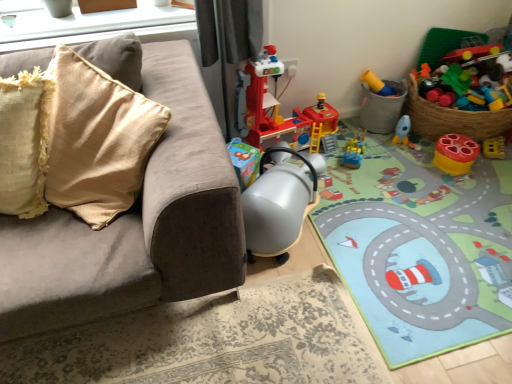
Question: Considering the relative positions of plastic yellow toy at upper right, which ranks as the fourth toy in right-to-left order, and matte plastic toy at right, the 5th toy in the left-to-right sequence, in the image provided, is plastic yellow toy at upper right, which ranks as the fourth toy in right-to-left order, to the right of matte plastic toy at right, the 5th toy in the left-to-right sequence, from the viewer's perspective?

Choices:
 (A) yes
 (B) no

Answer: (B)

Question: Does plastic yellow toy at upper right, which is the third toy in left-to-right order, have a smaller size compared to matte plastic toy at right, the 5th toy in the left-to-right sequence?

Choices:
 (A) no
 (B) yes

Answer: (A)

Question: Is plastic yellow toy at upper right, which ranks as the fourth toy in right-to-left order, shorter than matte plastic toy at right, the 5th toy in the left-to-right sequence?

Choices:
 (A) yes
 (B) no

Answer: (B)

Question: Is plastic yellow toy at upper right, which is the third toy in left-to-right order, with matte plastic toy at right, marked as the second toy in a right-to-left arrangement?

Choices:
 (A) no
 (B) yes

Answer: (A)

Question: Does plastic yellow toy at upper right, which is the third toy in left-to-right order, appear on the left side of matte plastic toy at right, the 5th toy in the left-to-right sequence?

Choices:
 (A) yes
 (B) no

Answer: (A)

Question: From the image's perspective, is matte plastic toy at right, marked as the second toy in a right-to-left arrangement, positioned above or below matte plastic rocket at lower right, which appears as the 3th toy when viewed from the right?

Choices:
 (A) below
 (B) above

Answer: (A)

Question: In the image, is matte plastic toy at right, the 5th toy in the left-to-right sequence, positioned in front of or behind matte plastic rocket at lower right, the fourth toy positioned from the left?

Choices:
 (A) front
 (B) behind

Answer: (A)

Question: In the image, is matte plastic toy at right, marked as the second toy in a right-to-left arrangement, on the left side or the right side of matte plastic rocket at lower right, which appears as the 3th toy when viewed from the right?

Choices:
 (A) right
 (B) left

Answer: (A)

Question: Considering the positions of matte plastic toy at right, marked as the second toy in a right-to-left arrangement, and matte plastic rocket at lower right, which appears as the 3th toy when viewed from the right, in the image, is matte plastic toy at right, marked as the second toy in a right-to-left arrangement, wider or thinner than matte plastic rocket at lower right, which appears as the 3th toy when viewed from the right,?

Choices:
 (A) thin
 (B) wide

Answer: (B)

Question: From the image's perspective, is matte plastic rocket at lower right, the fourth toy positioned from the left, above or below carpeted play mat at center?

Choices:
 (A) below
 (B) above

Answer: (B)

Question: From their relative heights in the image, would you say matte plastic rocket at lower right, the fourth toy positioned from the left, is taller or shorter than carpeted play mat at center?

Choices:
 (A) tall
 (B) short

Answer: (A)

Question: Considering the relative positions of matte plastic rocket at lower right, the fourth toy positioned from the left, and carpeted play mat at center in the image provided, is matte plastic rocket at lower right, the fourth toy positioned from the left, to the left or to the right of carpeted play mat at center?

Choices:
 (A) right
 (B) left

Answer: (B)

Question: From a real-world perspective, is matte plastic rocket at lower right, which appears as the 3th toy when viewed from the right, physically located above or below carpeted play mat at center?

Choices:
 (A) below
 (B) above

Answer: (B)

Question: In terms of width, does matte beige couch at left look wider or thinner when compared to matte plastic rocket at lower right, the fourth toy positioned from the left?

Choices:
 (A) wide
 (B) thin

Answer: (A)

Question: Based on their sizes in the image, would you say matte beige couch at left is bigger or smaller than matte plastic rocket at lower right, the fourth toy positioned from the left?

Choices:
 (A) big
 (B) small

Answer: (A)